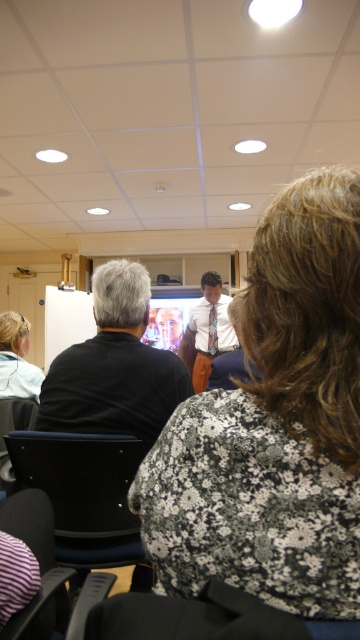
Based on the photo, you are sitting in the conference room and need to locate the white shirt with tie at center. From your current position in the black leather chair at lower left, where should you look relative to your position?

The white shirt with tie at center is above the black leather chair at lower left, so you should look upwards to locate it.

Looking at this image, you are standing at the entrance of the conference room and see the point marked as point (84, 496). What object does this point correspond to?

The point (84, 496) corresponds to the black leather chair at lower left.

You are an event planner setting up a photo shoot in this room. You need to position a 1.8m tall tripod between the floral fabric shirt at center and the black leather chair at lower left. Based on their heights, will the tripod be taller than either of them?

Result: The floral fabric shirt at center is much taller than the black leather chair at lower left. Since the tripod is 1.8m tall, it will be taller than both objects because even the taller object, the floral fabric shirt at center, is shorter than 1.8m.